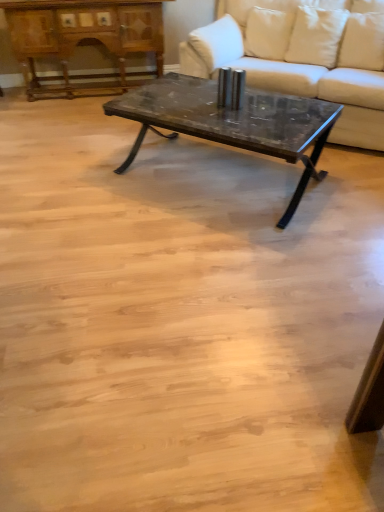
Where is `free point to the left of dark gray stone coffee table at center`? Image resolution: width=384 pixels, height=512 pixels. free point to the left of dark gray stone coffee table at center is located at coordinates (91, 216).